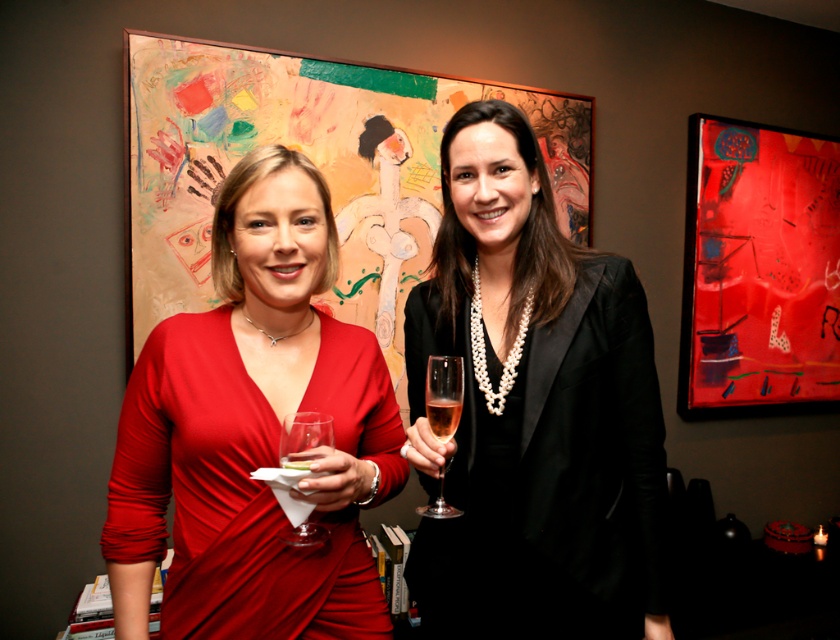
You are a photographer standing at a distance of 40 inches from the two women in the image. You want to take a closeup shot of the point at coordinate point (307, 416). Do you need to move closer or farther away to focus on that point?

The distance of point (307, 416) is 35.05 inches from the camera. Since you are currently 40 inches away, you need to move closer by approximately 4.95 inches to focus on that point.

You are at a party and need to hand a napkin to the person holding the clear glass wine glass at lower left. Which direction should you approach from relative to the matte red dress at center?

You should approach from the right side of the matte red dress at center because the clear glass wine glass at lower left is positioned to the right of it.

You are at a social event and want to approach the two women. Which point, point (213, 634) or point (291, 440), is closer to you?

Point (213, 634) is closer to you because it is further to the viewer than point (291, 440).